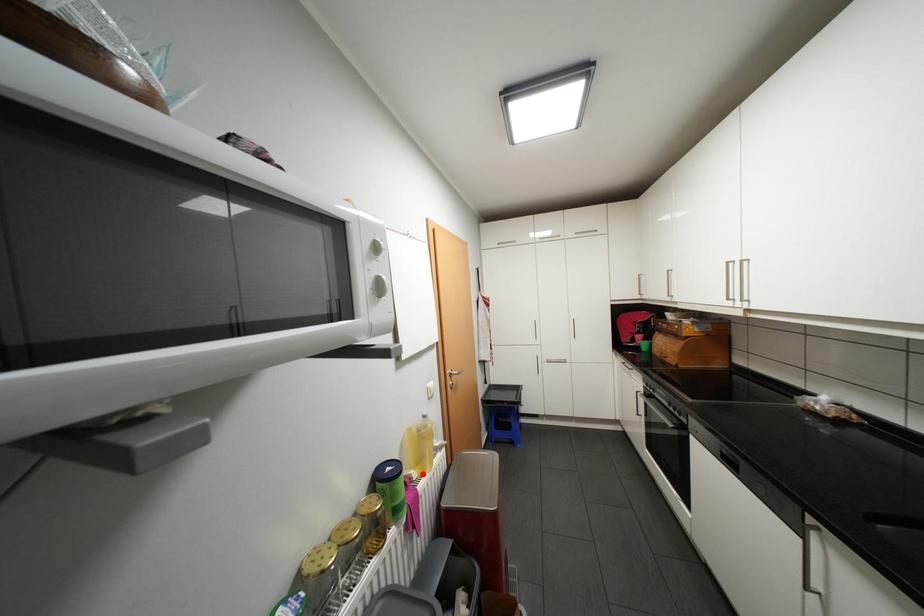
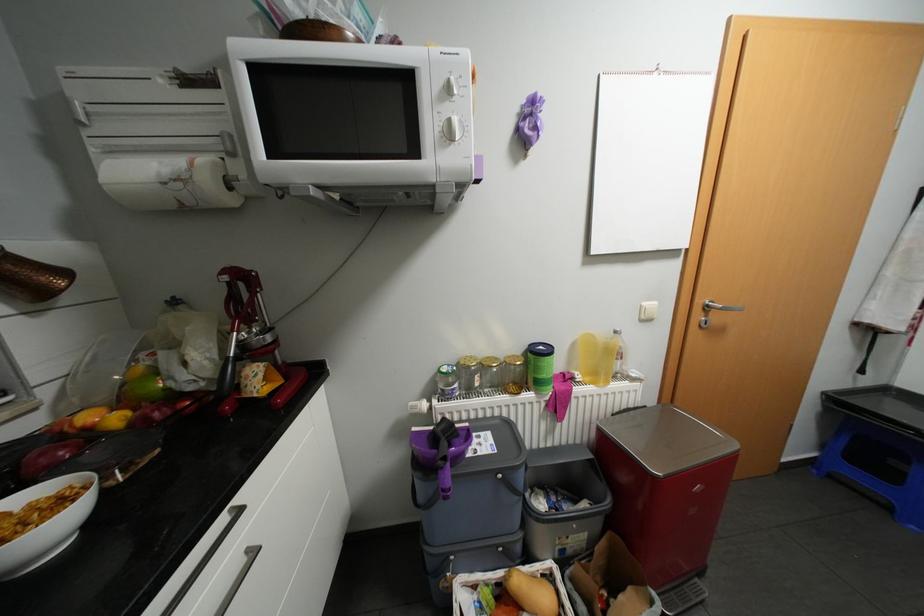
The point at the highlighted location is marked in the first image. Where is the corresponding point in the second image?

(587, 377)